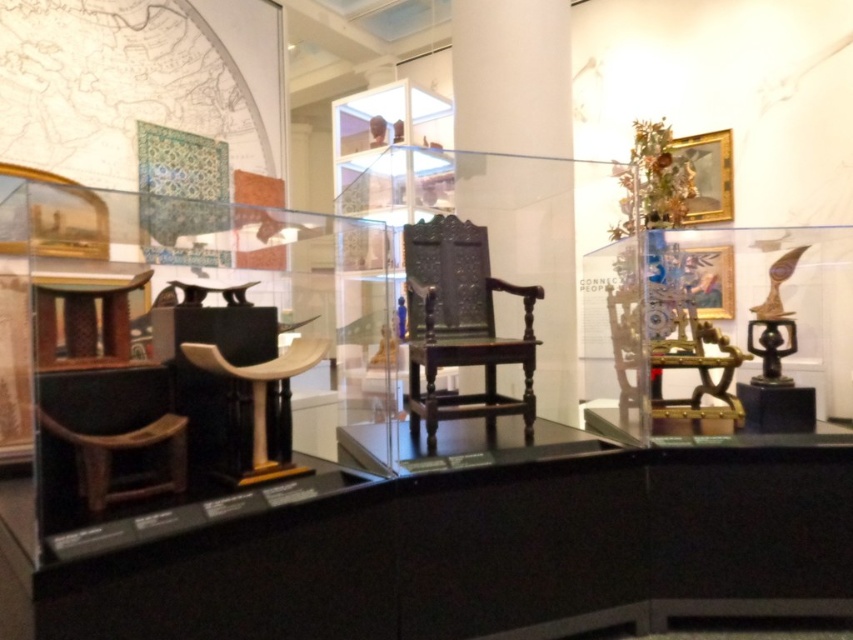
Question: Which object appears closest to the camera in this image?

Choices:
 (A) wooden chair at center
 (B) dark wood carved chair at center

Answer: (A)

Question: Considering the relative positions of dark wood carved chair at center and wooden chair at center in the image provided, where is dark wood carved chair at center located with respect to wooden chair at center?

Choices:
 (A) left
 (B) right

Answer: (B)

Question: Where is dark wood carved chair at center located in relation to wooden chair at center in the image?

Choices:
 (A) right
 (B) left

Answer: (A)

Question: Among these objects, which one is farthest from the camera?

Choices:
 (A) wooden chair at center
 (B) dark wood carved chair at center

Answer: (B)

Question: Which of the following is the closest to the observer?

Choices:
 (A) wooden chair at center
 (B) dark wood carved chair at center

Answer: (A)

Question: From the image, what is the correct spatial relationship of dark wood carved chair at center in relation to wooden chair at center?

Choices:
 (A) above
 (B) below

Answer: (A)